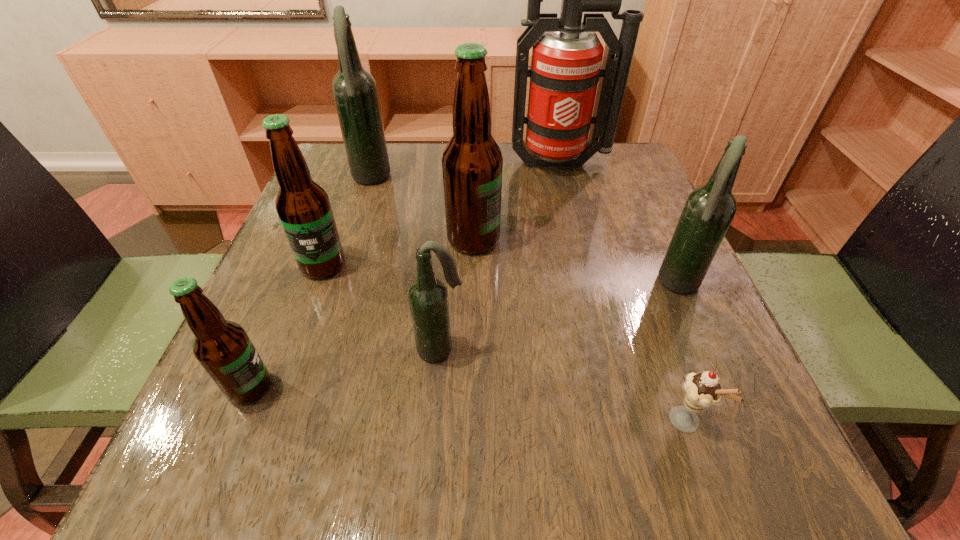
At what (x,y) coordinates should I click in order to perform the action: click on free point at the near edge. Please return your answer as a coordinate pair (x, y). The image size is (960, 540). Looking at the image, I should click on (373, 465).

Where is `free space at the left edge`? The width and height of the screenshot is (960, 540). free space at the left edge is located at coordinates (x=282, y=291).

You are a GUI agent. You are given a task and a screenshot of the screen. Output one action in this format:
    pyautogui.click(x=<x>, y=<y>)
    Task: Click on the free point at the right edge
    The image size is (960, 540).
    Given the screenshot: What is the action you would take?
    pyautogui.click(x=651, y=235)

I want to click on vacant region at the far left corner of the desktop, so click(362, 188).

The image size is (960, 540). I want to click on vacant region at the near left corner of the desktop, so click(236, 454).

Identify the location of vacant space that is in between the farthest dark beer bottle and the second dark beer bottle from left to right. The width and height of the screenshot is (960, 540). (405, 265).

Image resolution: width=960 pixels, height=540 pixels. Find the location of `vacant space that is in between the rightmost brown beer bottle and the second nearest dark beer bottle`. vacant space that is in between the rightmost brown beer bottle and the second nearest dark beer bottle is located at coordinates (577, 262).

You are a GUI agent. You are given a task and a screenshot of the screen. Output one action in this format:
    pyautogui.click(x=<x>, y=<y>)
    Task: Click on the free space between the second smallest brown beer bottle and the shortest object
    Image resolution: width=960 pixels, height=540 pixels.
    Given the screenshot: What is the action you would take?
    pyautogui.click(x=504, y=343)

The width and height of the screenshot is (960, 540). I want to click on vacant region between the fire extinguisher and the second biggest brown beer bottle, so click(442, 214).

Find the location of a particular element. The image size is (960, 540). free space between the rightmost beer bottle and the fire extinguisher is located at coordinates (620, 224).